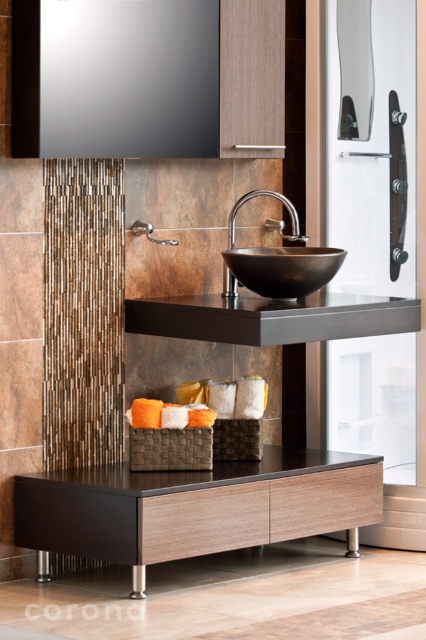
Can you confirm if matte black vanity at center is positioned to the left of black polished bowl at center?

Indeed, matte black vanity at center is positioned on the left side of black polished bowl at center.

Does point (313, 460) come in front of point (227, 260)?

No, it is not.

The width and height of the screenshot is (426, 640). Find the location of `matte black vanity at center`. matte black vanity at center is located at coordinates (195, 506).

Who is positioned more to the left, black polished bowl at center or satin nickel faucet at center?

From the viewer's perspective, satin nickel faucet at center appears more on the left side.

Is point (336, 266) farther from camera compared to point (227, 269)?

No, it is in front of (227, 269).

Where is `black polished bowl at center`? black polished bowl at center is located at coordinates (279, 269).

Is matte black vanity at center below satin nickel faucet at center?

Indeed, matte black vanity at center is positioned under satin nickel faucet at center.

Can you confirm if matte black vanity at center is positioned to the left of satin nickel faucet at center?

Yes, matte black vanity at center is to the left of satin nickel faucet at center.

You are a GUI agent. You are given a task and a screenshot of the screen. Output one action in this format:
    pyautogui.click(x=<x>, y=<y>)
    Task: Click on the matte black vanity at center
    
    Given the screenshot: What is the action you would take?
    pyautogui.click(x=195, y=506)

Find the location of a particular element. This screenshot has height=640, width=426. matte black vanity at center is located at coordinates (195, 506).